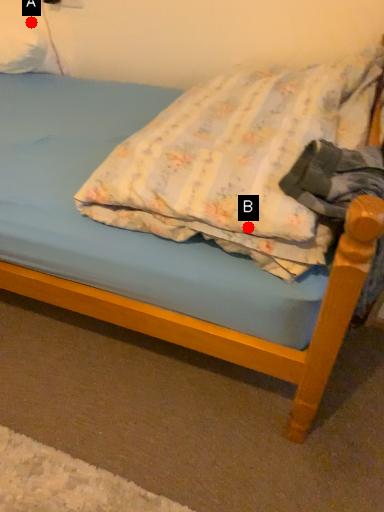
Question: Two points are circled on the image, labeled by A and B beside each circle. Among these points, which one is nearest to the camera?

Choices:
 (A) A is closer
 (B) B is closer

Answer: (B)